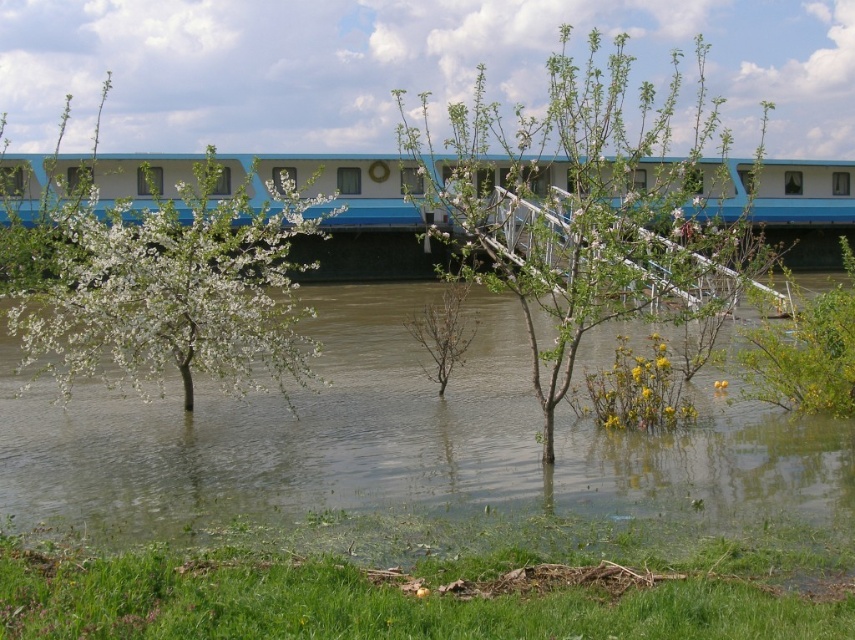
Question: Among these points, which one is nearest to the camera?

Choices:
 (A) (497, 228)
 (B) (387, 225)
 (C) (107, 401)
 (D) (824, 320)

Answer: (D)

Question: Can you confirm if white blossoming tree at center is positioned above yellow-green leafy bush at lower right?

Choices:
 (A) no
 (B) yes

Answer: (B)

Question: Does greenish-brown water at center appear under yellow-green leafy bush at lower right?

Choices:
 (A) yes
 (B) no

Answer: (A)

Question: Estimate the real-world distances between objects in this image. Which object is closer to the green leafy tree at center?

Choices:
 (A) blue glossy train at upper center
 (B) greenish-brown water at center
 (C) yellow-green leafy bush at lower right

Answer: (A)

Question: From the image, what is the correct spatial relationship of green leafy tree at center in relation to blue glossy train at upper center?

Choices:
 (A) above
 (B) below

Answer: (A)

Question: Which object is farther from the camera taking this photo?

Choices:
 (A) blue glossy train at upper center
 (B) white blossoming tree at center
 (C) yellow-green leafy bush at lower right

Answer: (A)